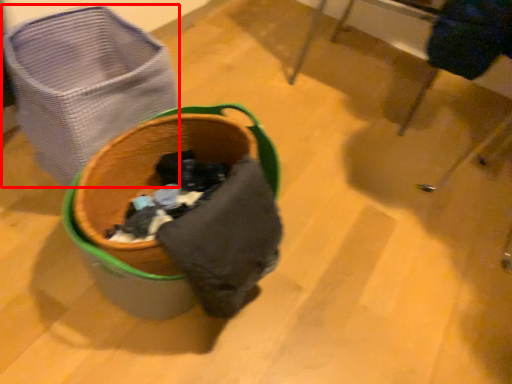
Question: Where is laundry basket (annotated by the red box) located in relation to furniture in the image?

Choices:
 (A) right
 (B) left

Answer: (B)